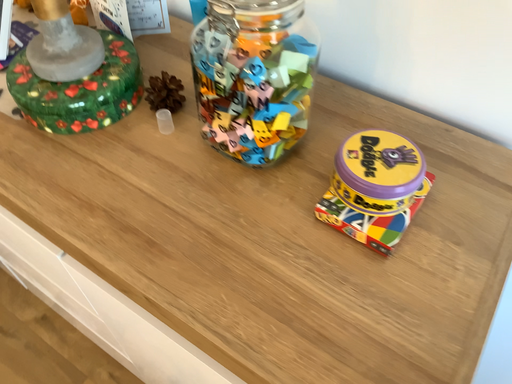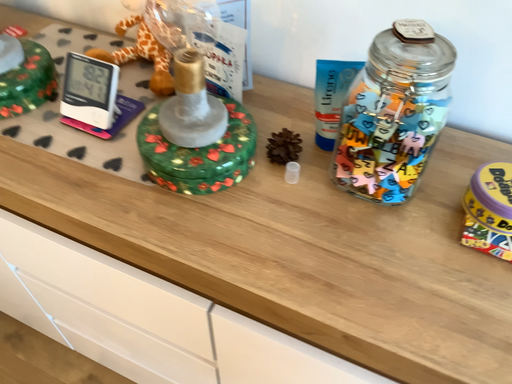
Question: How did the camera likely rotate when shooting the video?

Choices:
 (A) rotated right
 (B) rotated left

Answer: (A)